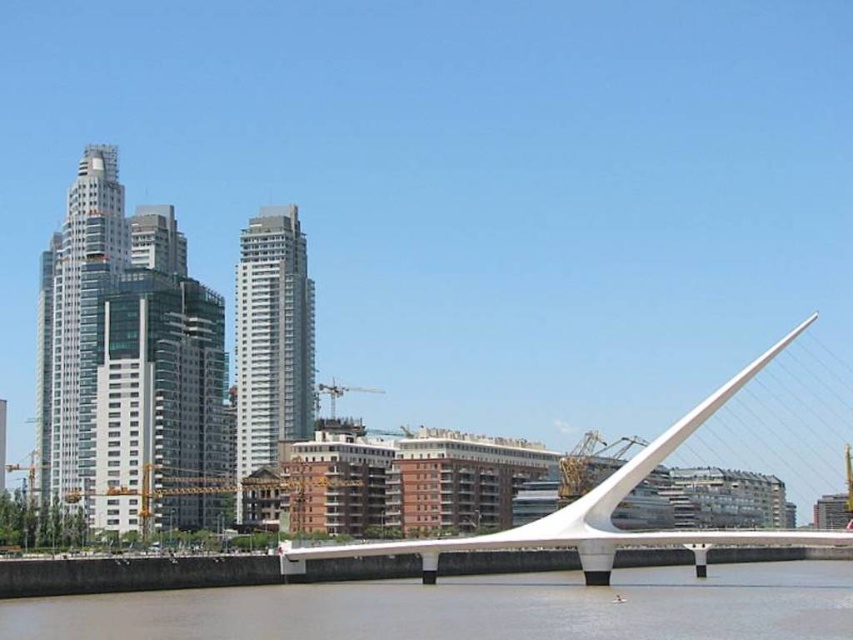
You are a city planner analyzing the urban layout. The point marked at coordinates (469, 608) is part of the brown sedimentary water at lower center. Which object from the scene is this point located in?

The point at coordinates (469, 608) is located in the brown sedimentary water at lower center.

You are a city planner assessing the urban layout. Given the brown sedimentary water at lower center and the white metallic bridge at center, which one has a narrower width?

The brown sedimentary water at lower center has a narrower width than the white metallic bridge at center.